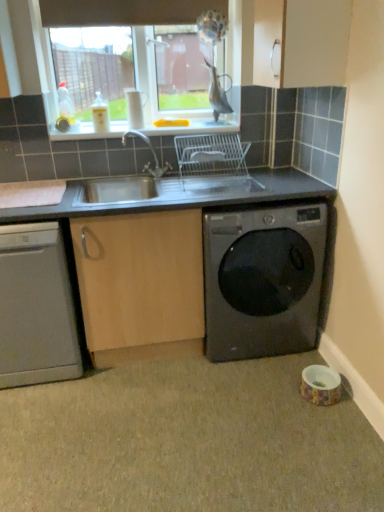
Question: Should I look upward or downward to see black glossy washing machine at lower right?

Choices:
 (A) down
 (B) up

Answer: (A)

Question: From the image's perspective, does gray matte granite at lower right appear lower than satin silver dishwasher at lower left?

Choices:
 (A) no
 (B) yes

Answer: (B)

Question: Is gray matte granite at lower right outside of satin silver dishwasher at lower left?

Choices:
 (A) yes
 (B) no

Answer: (A)

Question: From a real-world perspective, is gray matte granite at lower right beneath satin silver dishwasher at lower left?

Choices:
 (A) no
 (B) yes

Answer: (B)

Question: Does gray matte granite at lower right have a lesser width compared to satin silver dishwasher at lower left?

Choices:
 (A) yes
 (B) no

Answer: (B)

Question: Can you confirm if gray matte granite at lower right is positioned to the left of satin silver dishwasher at lower left?

Choices:
 (A) no
 (B) yes

Answer: (A)

Question: Considering the relative sizes of gray matte granite at lower right and satin silver dishwasher at lower left in the image provided, is gray matte granite at lower right taller than satin silver dishwasher at lower left?

Choices:
 (A) no
 (B) yes

Answer: (A)

Question: Does brown fabric exhaust hood at upper center have a lesser height compared to black glossy washing machine at lower right?

Choices:
 (A) no
 (B) yes

Answer: (B)

Question: Is brown fabric exhaust hood at upper center to the left of black glossy washing machine at lower right from the viewer's perspective?

Choices:
 (A) yes
 (B) no

Answer: (A)

Question: Is brown fabric exhaust hood at upper center next to black glossy washing machine at lower right and touching it?

Choices:
 (A) yes
 (B) no

Answer: (B)

Question: Is brown fabric exhaust hood at upper center positioned in front of black glossy washing machine at lower right?

Choices:
 (A) no
 (B) yes

Answer: (A)

Question: Is brown fabric exhaust hood at upper center oriented away from black glossy washing machine at lower right?

Choices:
 (A) no
 (B) yes

Answer: (A)

Question: From a real-world perspective, is brown fabric exhaust hood at upper center beneath black glossy washing machine at lower right?

Choices:
 (A) no
 (B) yes

Answer: (A)

Question: From the image's perspective, does black glossy washing machine at lower right appear lower than white plastic sink at upper center?

Choices:
 (A) no
 (B) yes

Answer: (B)